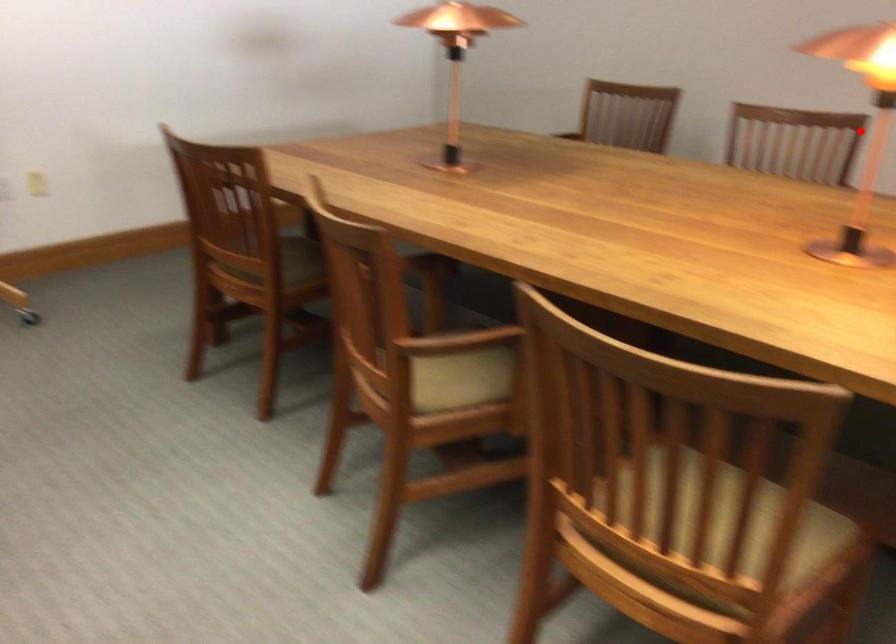
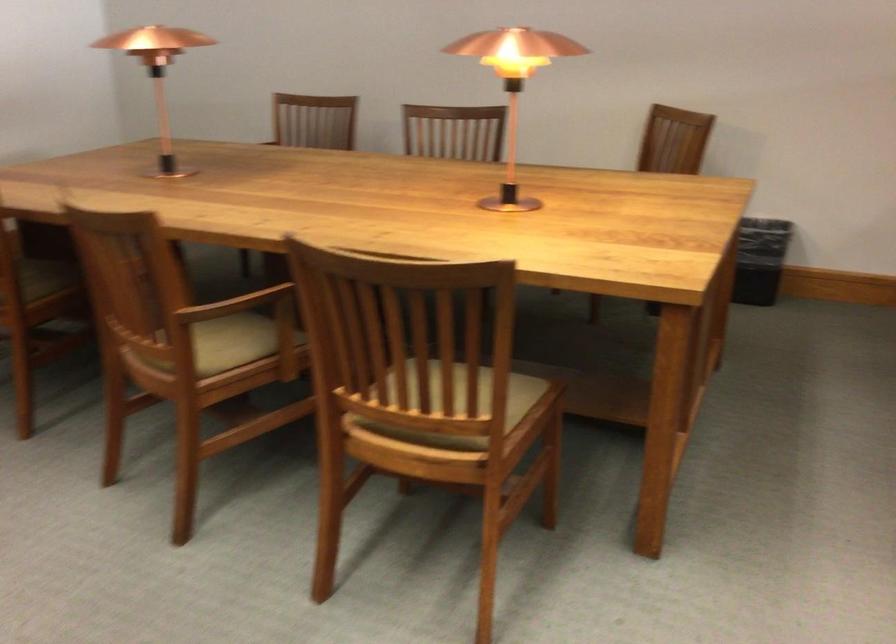
Question: I am providing you with two images of the same scene from different viewpoints. In image1, a red point is highlighted. Considering the same 3D point in image2, which of the following is correct?

Choices:
 (A) It is closer
 (B) It is farther

Answer: (B)